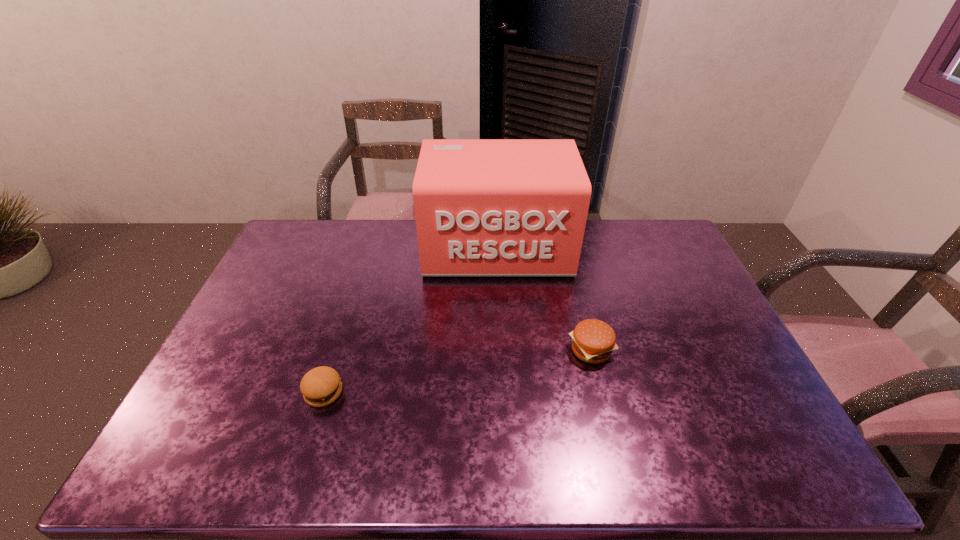
Identify the location of vacant space at the far edge. (611, 227).

The image size is (960, 540). Identify the location of free space at the near edge of the desktop. (368, 471).

In the image, there is a desktop. Identify the location of vacant space at the left edge. (274, 311).

In the image, there is a desktop. Identify the location of free space at the right edge. (682, 264).

The width and height of the screenshot is (960, 540). In the image, there is a desktop. Identify the location of free space at the far right corner. (658, 234).

The width and height of the screenshot is (960, 540). I want to click on vacant area that lies between the second nearest object and the left hamburger, so click(x=457, y=371).

Locate an element on the screen. free point between the left hamburger and the farther hamburger is located at coordinates (457, 371).

Identify the location of unoccupied area between the left hamburger and the second tallest object. The height and width of the screenshot is (540, 960). (457, 371).

Where is `free space that is in between the leftmost object and the tallest object`? free space that is in between the leftmost object and the tallest object is located at coordinates coord(411,320).

Where is `empty space between the shortest object and the second nearest object`? empty space between the shortest object and the second nearest object is located at coordinates coord(457,371).